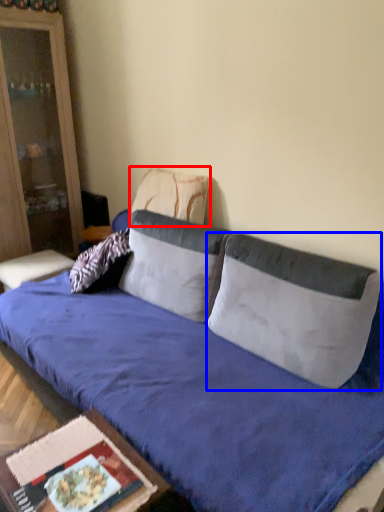
Question: Among these objects, which one is farthest to the camera, pillow (highlighted by a red box) or pillow (highlighted by a blue box)?

Choices:
 (A) pillow
 (B) pillow

Answer: (A)